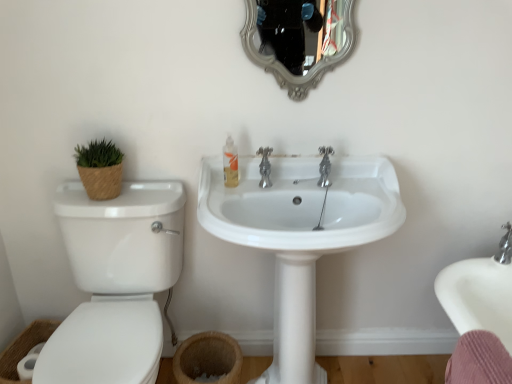
Question: Is chrome metallic faucet at center not close to white glossy sink at center?

Choices:
 (A) no
 (B) yes

Answer: (A)

Question: Is white glossy sink at center surrounded by chrome metallic faucet at center?

Choices:
 (A) no
 (B) yes

Answer: (A)

Question: Is chrome metallic faucet at center facing away from white glossy sink at center?

Choices:
 (A) yes
 (B) no

Answer: (B)

Question: From a real-world perspective, does chrome metallic faucet at center stand above white glossy sink at center?

Choices:
 (A) no
 (B) yes

Answer: (B)

Question: Is chrome metallic faucet at center at the left side of white glossy sink at center?

Choices:
 (A) no
 (B) yes

Answer: (B)

Question: Considering the relative positions of chrome metallic faucet at center and white glossy sink at center in the image provided, is chrome metallic faucet at center to the right of white glossy sink at center from the viewer's perspective?

Choices:
 (A) no
 (B) yes

Answer: (A)

Question: From the image's perspective, would you say translucent plastic soap dispenser at center is shown under white glossy sink at center?

Choices:
 (A) yes
 (B) no

Answer: (B)

Question: Could you tell me if translucent plastic soap dispenser at center is facing white glossy sink at center?

Choices:
 (A) yes
 (B) no

Answer: (B)

Question: Would you consider translucent plastic soap dispenser at center to be distant from white glossy sink at center?

Choices:
 (A) no
 (B) yes

Answer: (A)

Question: Can you confirm if translucent plastic soap dispenser at center is wider than white glossy sink at center?

Choices:
 (A) yes
 (B) no

Answer: (B)

Question: Is translucent plastic soap dispenser at center to the left of white glossy sink at center from the viewer's perspective?

Choices:
 (A) yes
 (B) no

Answer: (A)

Question: Is translucent plastic soap dispenser at center positioned behind white glossy sink at center?

Choices:
 (A) yes
 (B) no

Answer: (A)

Question: Can you confirm if white glossy toilet at left is taller than silver/gilded mirror at upper center?

Choices:
 (A) no
 (B) yes

Answer: (B)